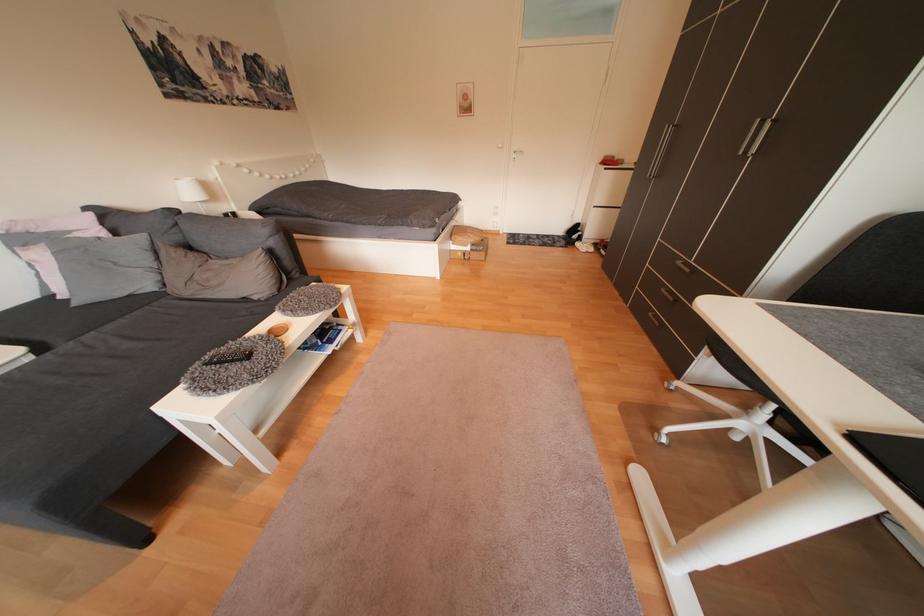
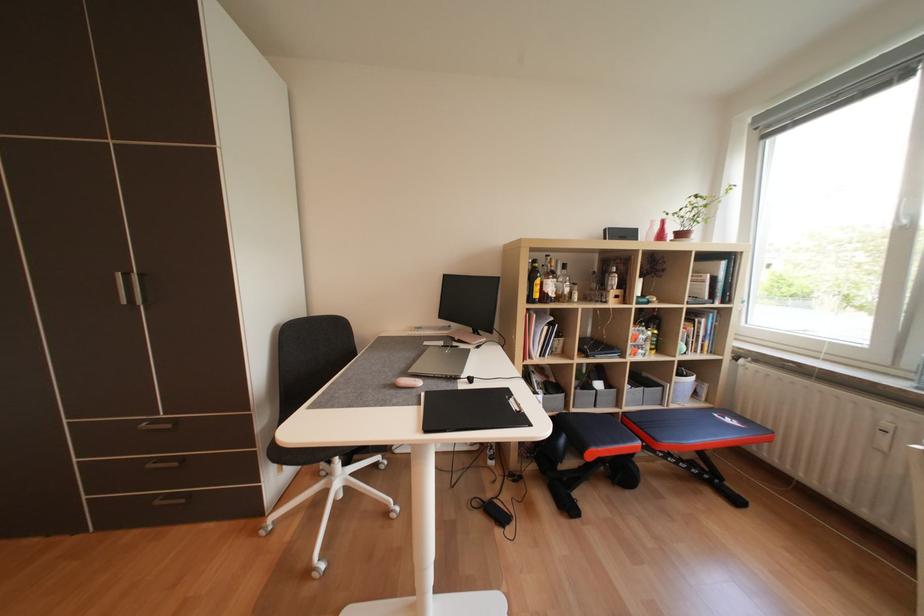
The first image is from the beginning of the video and the second image is from the end. How did the camera likely rotate when shooting the video?

The camera rotated toward right-down.